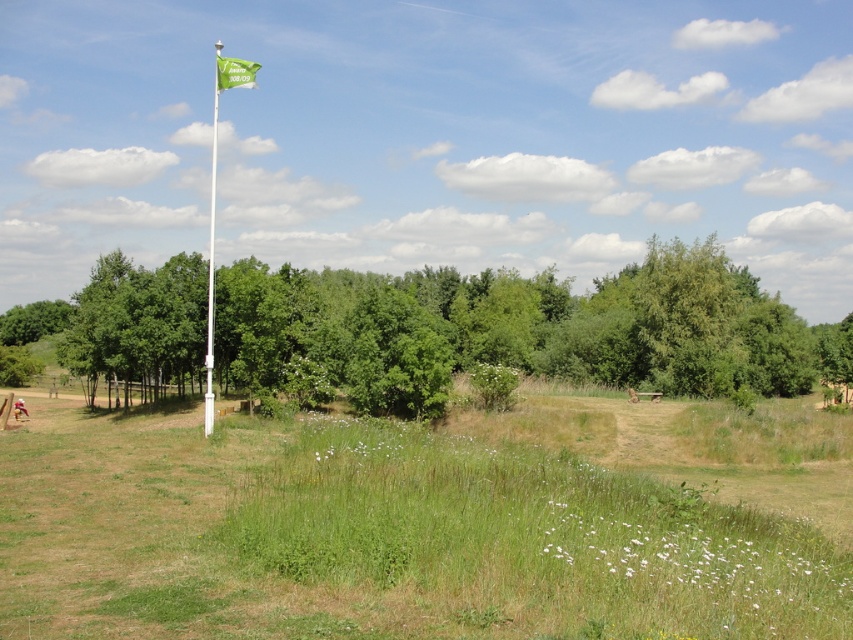
You are standing at the point marked as point (531, 324). Looking around, you notice a green leafy tree at center. Which direction should you face to see the green leafy tree at center?

Since you are already at the point where the green leafy tree at center is located, you would need to look around your current position to see it. However, since the tree is at the center, facing any direction might not necessarily show it unless you are facing towards the center of the scene.

From the picture: You are standing at the center of the grassy area and want to place a new bench exactly 1 meter to the north of the white plastic flag pole at center. Given that the flag pole is at coordinates point 0.416, 0.249, can you determine the coordinates where the bench should be placed?

The white plastic flag pole at center is located at point (212, 266). To place the bench 1 meter north, you would need to adjust the y coordinate by adding 1 meter. However, without knowing the coordinate system scale, it is impossible to determine the exact new coordinates. Please provide the scale of the coordinate system to calculate accurately.

You are standing in the serene outdoor scene described. A drone is flying towards a specific point in the image. The point is located at coordinates point [212,189]. If the drone needs to maintain a minimum altitude of 200 meters to avoid detection, will it be safe at that point?

The distance of point [212,189] from the viewer is 194.03 meters. Since this distance is less than the required 200 meters minimum altitude, the drone will be too close and may be detected.